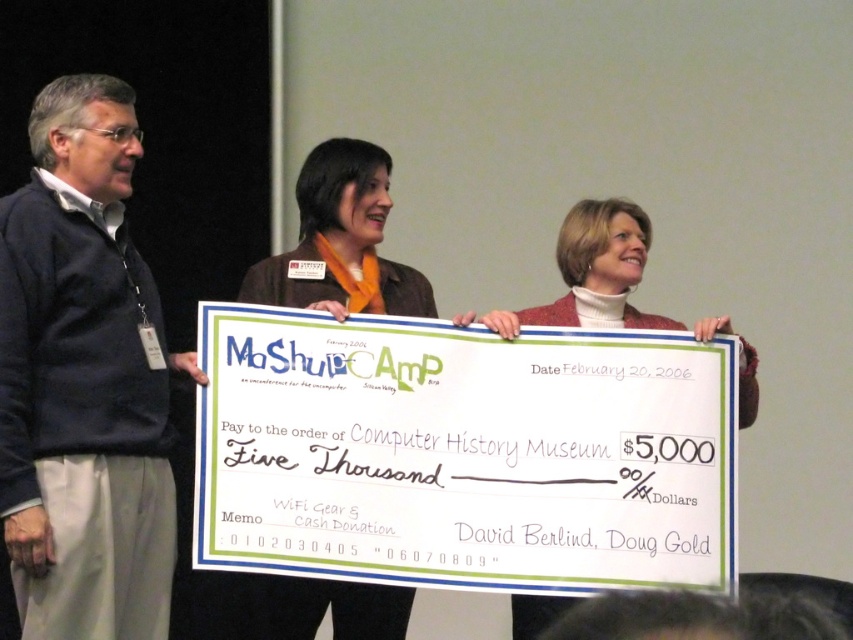
Measure the distance from dark blue sweater at left to white turtleneck sweater at center.

1.57 meters

Does dark blue sweater at left have a greater width compared to white turtleneck sweater at center?

No, dark blue sweater at left is not wider than white turtleneck sweater at center.

Is point (112, 237) behind point (636, 317)?

That is False.

The image size is (853, 640). Find the location of `dark blue sweater at left`. dark blue sweater at left is located at coordinates (84, 380).

Does point (521, 396) come behind point (383, 284)?

That is False.

Which of these two, white paper check at center or brown leather jacket at center, stands taller?

Standing taller between the two is white paper check at center.

The image size is (853, 640). Find the location of `white paper check at center`. white paper check at center is located at coordinates (463, 452).

The image size is (853, 640). Identify the location of white paper check at center. (463, 452).

Who is taller, white paper check at center or white turtleneck sweater at center?

With more height is white paper check at center.

Between point (689, 339) and point (509, 321), which one is positioned behind?

The point (509, 321) is more distant.

The image size is (853, 640). What do you see at coordinates (463, 452) in the screenshot?
I see `white paper check at center` at bounding box center [463, 452].

Where is `white paper check at center`? This screenshot has height=640, width=853. white paper check at center is located at coordinates click(x=463, y=452).